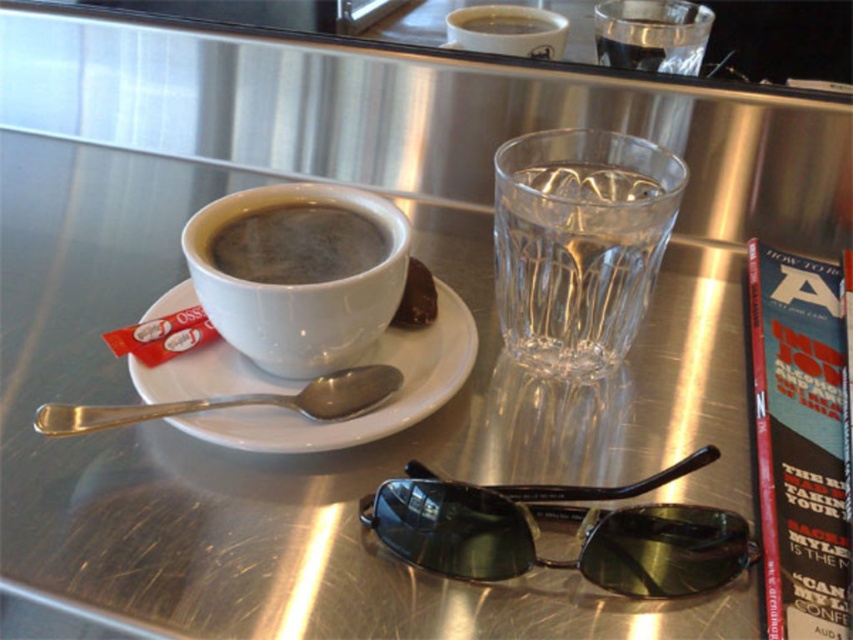
You are a person trying to reach for the clear glass water at center without moving the white ceramic saucer at center. Is this possible?

The white ceramic saucer at center is behind the clear glass water at center, so you can reach for the clear glass water at center without moving the white ceramic saucer at center.

You are trying to place a new item between the black plastic goggles at lower center and the white ceramic saucer at center. Is there enough space for it?

The black plastic goggles at lower center is to the right of white ceramic saucer at center, so there is space between them for the new item.

You are a delivery person who needs to place a rectangular box that is 12 inches wide on the reflective metallic surface. The box must be placed between the black plastic goggles at lower center and the matte white cup at upper center. Can the box fit horizontally between them without overlapping either object?

The black plastic goggles at lower center might be wider than the matte white cup at upper center, so the box that is 12 inches wide may or may not fit horizontally between them. The exact width comparison is uncertain based on the given information.